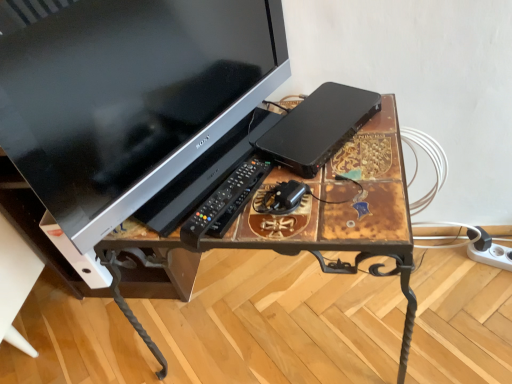
Find the location of a particular element. Image resolution: width=512 pixels, height=384 pixels. vacant space in between black plastic computer at center and black plastic power adapter at center is located at coordinates (296, 174).